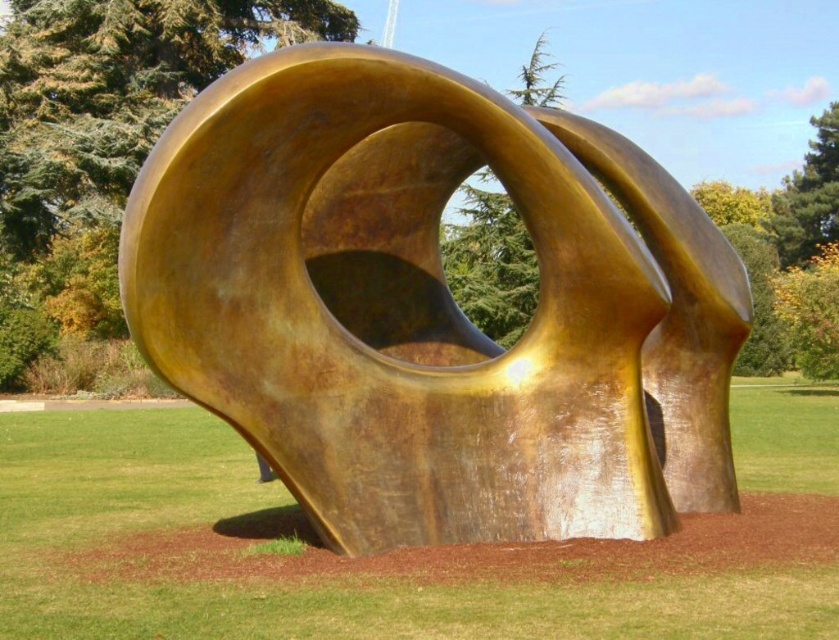
You are standing in the park and see the gold polished sculpture at center and the green grass at center. Which object is positioned to the left?

The gold polished sculpture at center is to the left of the green grass at center.

You are standing in a park and want to take a photo of the sculpture. The camera you are using has a maximum focus range of 25 feet. Is the point at coordinates point (x=551, y=244) within the camera focus range?

The distance between point (x=551, y=244) and the camera is 23.70 feet, which is within the camera focus range of 25 feet. Therefore, the point is within range.

You are a landscape architect planning to install a new lighting system around the gold polished sculpture at center and the green grass at center. Considering their heights, which object will require taller light fixtures to illuminate properly?

The gold polished sculpture at center has a greater height compared to the green grass at center, so it will require taller light fixtures to illuminate properly.